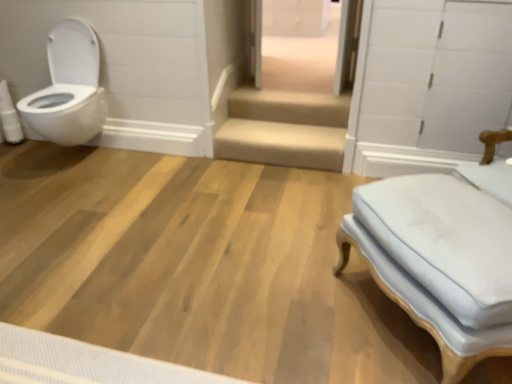
Question: Considering the relative sizes of white glossy toilet at left and white glossy drawer at upper center in the image provided, is white glossy toilet at left shorter than white glossy drawer at upper center?

Choices:
 (A) no
 (B) yes

Answer: (A)

Question: Considering the relative sizes of white glossy toilet at left and white glossy drawer at upper center in the image provided, is white glossy toilet at left bigger than white glossy drawer at upper center?

Choices:
 (A) yes
 (B) no

Answer: (B)

Question: Would you consider white glossy toilet at left to be distant from white glossy drawer at upper center?

Choices:
 (A) no
 (B) yes

Answer: (B)

Question: Is white glossy toilet at left touching white glossy drawer at upper center?

Choices:
 (A) yes
 (B) no

Answer: (B)

Question: Does white glossy toilet at left contain white glossy drawer at upper center?

Choices:
 (A) no
 (B) yes

Answer: (A)

Question: From the image's perspective, is white glossy drawer at upper center located above or below white fabric ottoman at right?

Choices:
 (A) above
 (B) below

Answer: (A)

Question: From a real-world perspective, relative to white fabric ottoman at right, is white glossy drawer at upper center vertically above or below?

Choices:
 (A) above
 (B) below

Answer: (A)

Question: Relative to white fabric ottoman at right, is white glossy drawer at upper center in front or behind?

Choices:
 (A) front
 (B) behind

Answer: (B)

Question: Does point (287, 29) appear closer or farther from the camera than point (498, 321)?

Choices:
 (A) farther
 (B) closer

Answer: (A)

Question: Would you say white fabric ottoman at right is to the left or to the right of white glossy drawer at upper center in the picture?

Choices:
 (A) right
 (B) left

Answer: (A)

Question: Based on their sizes in the image, would you say white fabric ottoman at right is bigger or smaller than white glossy drawer at upper center?

Choices:
 (A) small
 (B) big

Answer: (A)

Question: Is point (454, 347) closer or farther from the camera than point (266, 6)?

Choices:
 (A) farther
 (B) closer

Answer: (B)

Question: From the image's perspective, relative to white glossy drawer at upper center, is white fabric ottoman at right above or below?

Choices:
 (A) above
 (B) below

Answer: (B)

Question: Is white glossy toilet at left situated inside white fabric ottoman at right or outside?

Choices:
 (A) inside
 (B) outside

Answer: (B)

Question: In terms of height, does white glossy toilet at left look taller or shorter compared to white fabric ottoman at right?

Choices:
 (A) tall
 (B) short

Answer: (A)